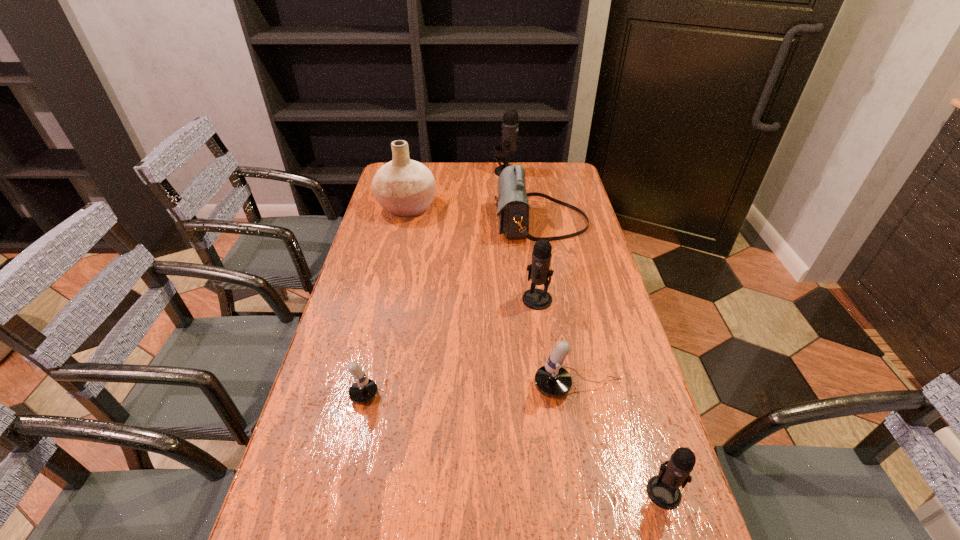
At what (x,y) coordinates should I click in order to perform the action: click on object that is the fourth nearest to the reddish-brown pottery. Please return your answer as a coordinate pair (x, y). This screenshot has width=960, height=540. Looking at the image, I should click on (364, 390).

The width and height of the screenshot is (960, 540). What are the coordinates of `object that is the second nearest to the shoulder bag` in the screenshot? It's located at (537, 299).

Identify the location of microphone object that ranks as the closest to the shoulder bag. The image size is (960, 540). (510, 124).

Identify which microphone is the fourth closest to the second biggest black microphone. Please provide its 2D coordinates. Your answer should be formatted as a tuple, i.e. [(x, y)], where the tuple contains the x and y coordinates of a point satisfying the conditions above.

[(510, 124)]

Identify which black microphone is the third closest to the reddish-brown pottery. Please provide its 2D coordinates. Your answer should be formatted as a tuple, i.e. [(x, y)], where the tuple contains the x and y coordinates of a point satisfying the conditions above.

[(663, 489)]

Point out which black microphone is positioned as the nearest to the bigger white microphone. Please provide its 2D coordinates. Your answer should be formatted as a tuple, i.e. [(x, y)], where the tuple contains the x and y coordinates of a point satisfying the conditions above.

[(663, 489)]

Where is `vacant space that satisfies the following two spatial constraints: 1. to pour from the handle of the pottery; 2. on the back side of the right white microphone`? This screenshot has height=540, width=960. vacant space that satisfies the following two spatial constraints: 1. to pour from the handle of the pottery; 2. on the back side of the right white microphone is located at coordinates (365, 388).

Where is `free region that satisfies the following two spatial constraints: 1. to pour from the handle of the smallest black microphone; 2. on the right side of the pottery`? The width and height of the screenshot is (960, 540). free region that satisfies the following two spatial constraints: 1. to pour from the handle of the smallest black microphone; 2. on the right side of the pottery is located at coordinates (341, 491).

Identify the location of free point that satisfies the following two spatial constraints: 1. to pour from the handle of the reddish-brown pottery; 2. on the left side of the second nearest black microphone. (386, 299).